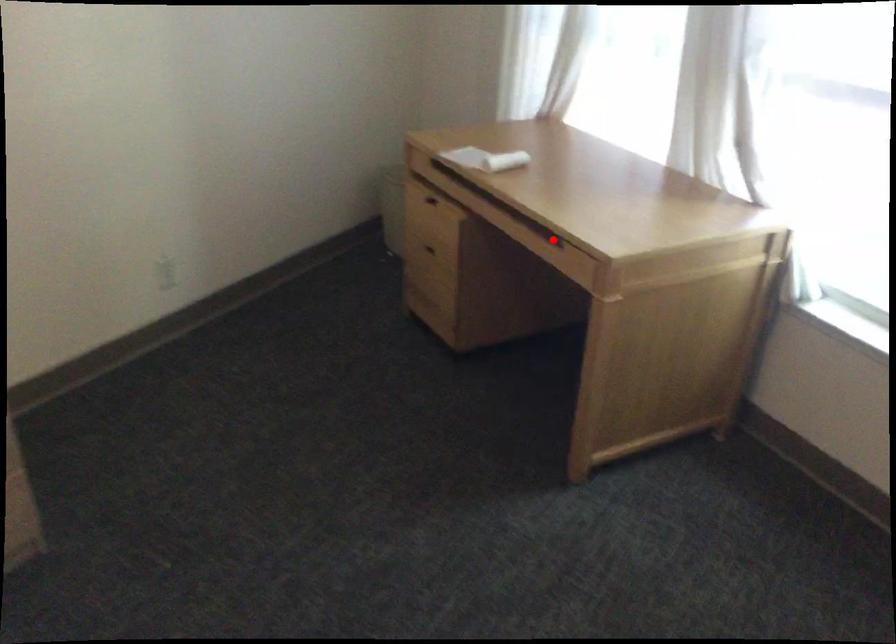
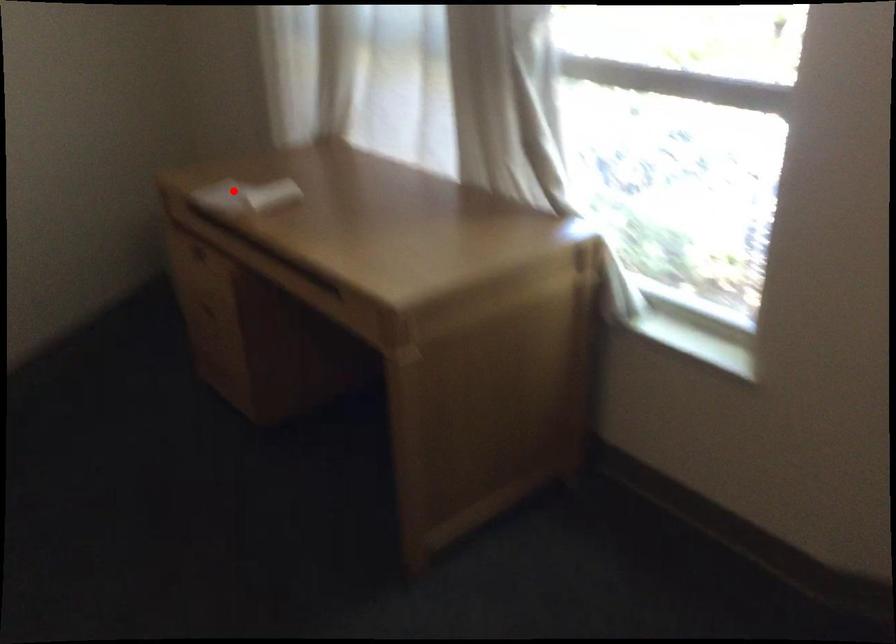
I am providing you with two images of the same scene from different viewpoints. A red point is marked on the first image and another point is marked on the second image. Does the point marked in image1 correspond to the same location as the one in image2?

No